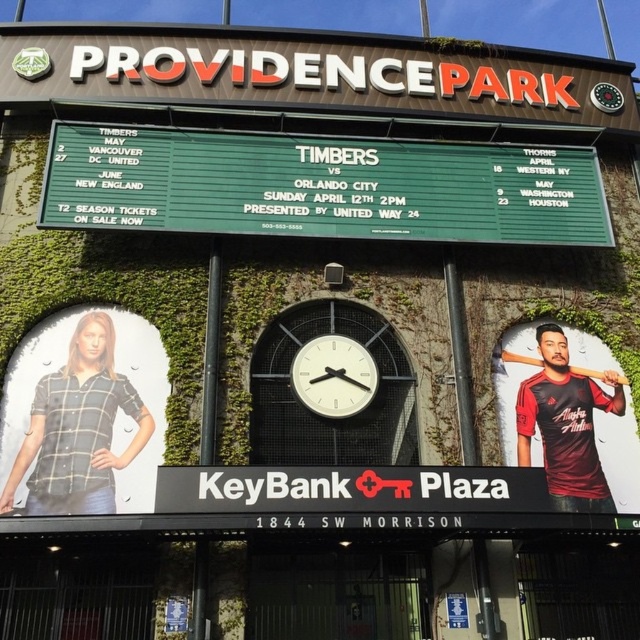
Question: Which object appears farthest from the camera in this image?

Choices:
 (A) white plastic clock at center
 (B) black matte baseball bat at center

Answer: (B)

Question: Which object appears closest to the camera in this image?

Choices:
 (A) black matte baseball bat at center
 (B) green wooden scoreboard at center
 (C) white plastic clock at center

Answer: (C)

Question: Does green wooden scoreboard at center have a smaller size compared to maroon jersey at right?

Choices:
 (A) no
 (B) yes

Answer: (A)

Question: Is maroon jersey at right positioned at the back of black matte baseball bat at center?

Choices:
 (A) yes
 (B) no

Answer: (B)

Question: Which point is farther to the camera?

Choices:
 (A) green wooden scoreboard at center
 (B) black matte baseball bat at center

Answer: (B)

Question: Does maroon jersey at right have a larger size compared to black matte baseball bat at center?

Choices:
 (A) yes
 (B) no

Answer: (A)